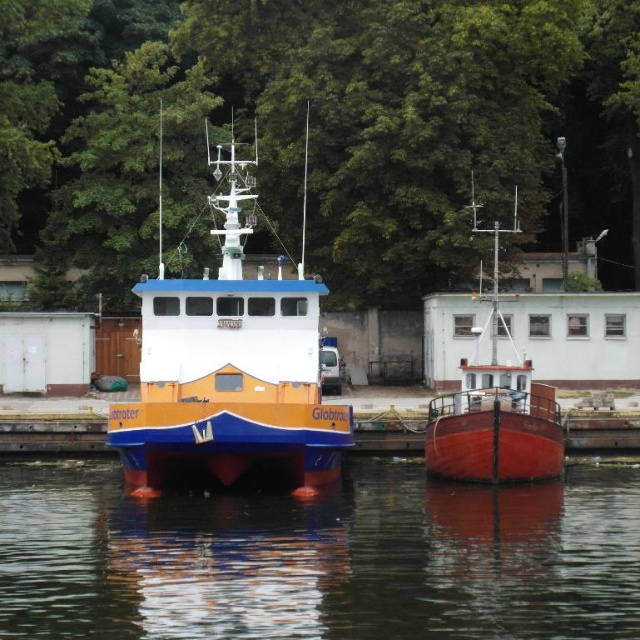
Is glossy water at lower center positioned at the back of smooth red boat at center?

No, glossy water at lower center is in front of smooth red boat at center.

Can you confirm if glossy water at lower center is wider than smooth red boat at center?

Yes, glossy water at lower center is wider than smooth red boat at center.

Is point (621, 595) more distant than point (492, 308)?

That is False.

This screenshot has width=640, height=640. In order to click on glossy water at lower center in this screenshot , I will do `click(320, 557)`.

Who is positioned more to the right, green leafy tree at upper center or smooth red boat at center?

Positioned to the right is smooth red boat at center.

Between point (52, 262) and point (499, 410), which one is positioned in front?

Positioned in front is point (499, 410).

Where is `green leafy tree at upper center`? green leafy tree at upper center is located at coordinates (321, 134).

Is point (276, 364) farther from viewer compared to point (545, 413)?

That is False.

Based on the photo, is orange matte boat at center shorter than smooth red boat at center?

In fact, orange matte boat at center may be taller than smooth red boat at center.

Who is more forward, (x=216, y=296) or (x=476, y=435)?

Positioned in front is point (x=476, y=435).

Where is `orange matte boat at center`? This screenshot has width=640, height=640. orange matte boat at center is located at coordinates (228, 372).